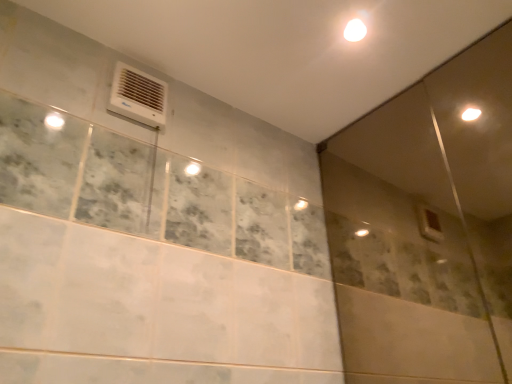
Question: In terms of height, does white plastic air conditioning unit at upper left look taller or shorter compared to transparent glass screen door at upper right?

Choices:
 (A) tall
 (B) short

Answer: (B)

Question: Considering the positions of white plastic air conditioning unit at upper left and transparent glass screen door at upper right in the image, is white plastic air conditioning unit at upper left bigger or smaller than transparent glass screen door at upper right?

Choices:
 (A) small
 (B) big

Answer: (A)

Question: Which object is the closest to the transparent glass screen door at upper right?

Choices:
 (A) white glossy light at upper center
 (B) white plastic air conditioning unit at upper left

Answer: (A)

Question: Which object is the closest to the transparent glass screen door at upper right?

Choices:
 (A) white plastic air conditioning unit at upper left
 (B) white glossy light at upper center

Answer: (B)